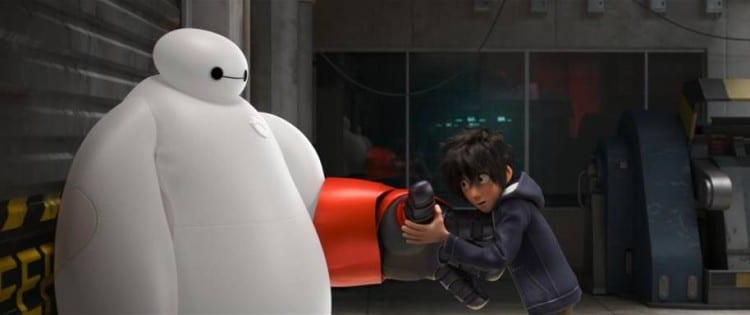
The width and height of the screenshot is (750, 315). Identify the location of metal door. (58, 95).